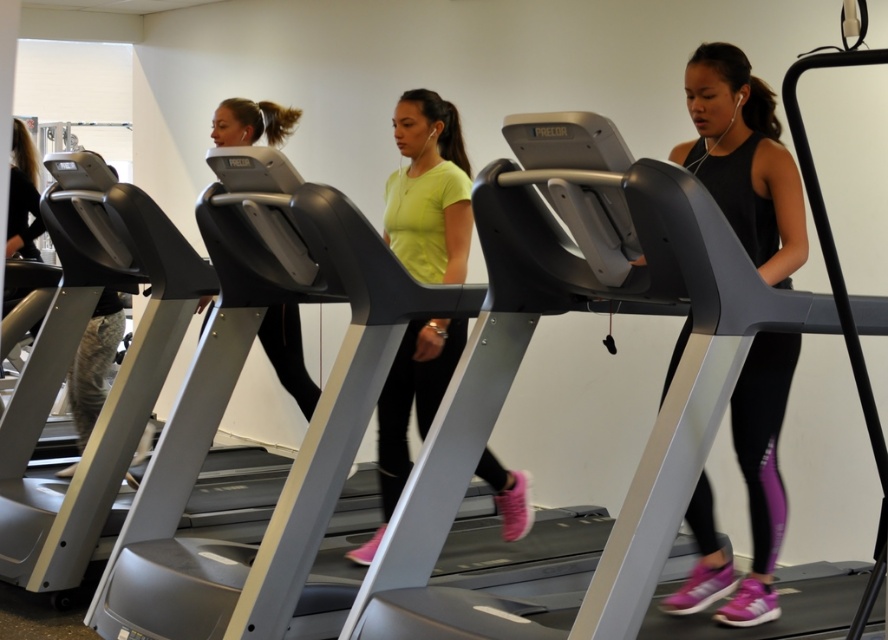
Question: Among these points, which one is nearest to the camera?

Choices:
 (A) (307, 404)
 (B) (427, 332)

Answer: (B)

Question: In this image, where is black matte tank top at center located relative to neon yellow t-shirt at center?

Choices:
 (A) below
 (B) above

Answer: (B)

Question: In this image, where is black matte tank top at center located relative to matte black treadmill at center?

Choices:
 (A) left
 (B) right

Answer: (B)

Question: Is black matte tank top at center positioned behind matte black treadmill at center?

Choices:
 (A) yes
 (B) no

Answer: (B)

Question: Which point is closer to the camera taking this photo?

Choices:
 (A) (791, 188)
 (B) (280, 348)
 (C) (390, 189)

Answer: (A)

Question: Which is farther from the black matte tank top at center?

Choices:
 (A) neon yellow t-shirt at center
 (B) matte black treadmill at center

Answer: (B)